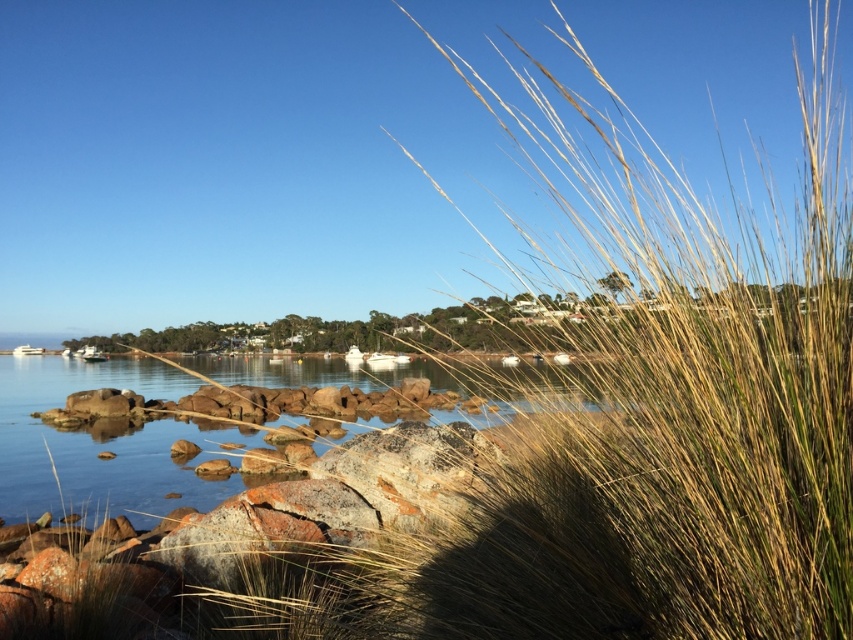
Question: Can you confirm if dry grass at center is positioned above golden grass at center?

Choices:
 (A) yes
 (B) no

Answer: (A)

Question: Which object is farther from the camera taking this photo?

Choices:
 (A) dry grass at center
 (B) golden grass at center

Answer: (B)

Question: Which object is farther from the camera taking this photo?

Choices:
 (A) golden grass at center
 (B) dry grass at center

Answer: (A)

Question: Does dry grass at center appear over golden grass at center?

Choices:
 (A) yes
 (B) no

Answer: (A)

Question: Does dry grass at center come in front of golden grass at center?

Choices:
 (A) no
 (B) yes

Answer: (B)